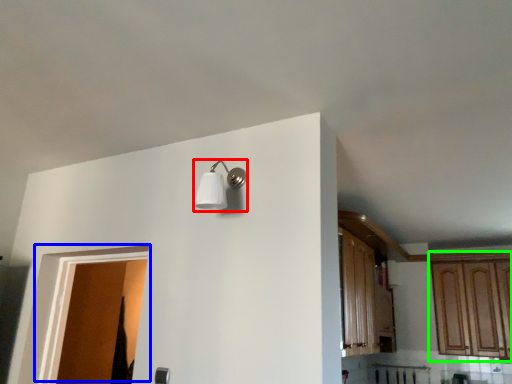
Question: Which is farther away from light fixture (highlighted by a red box)? door (highlighted by a blue box) or cabinetry (highlighted by a green box)?

Choices:
 (A) door
 (B) cabinetry

Answer: (B)